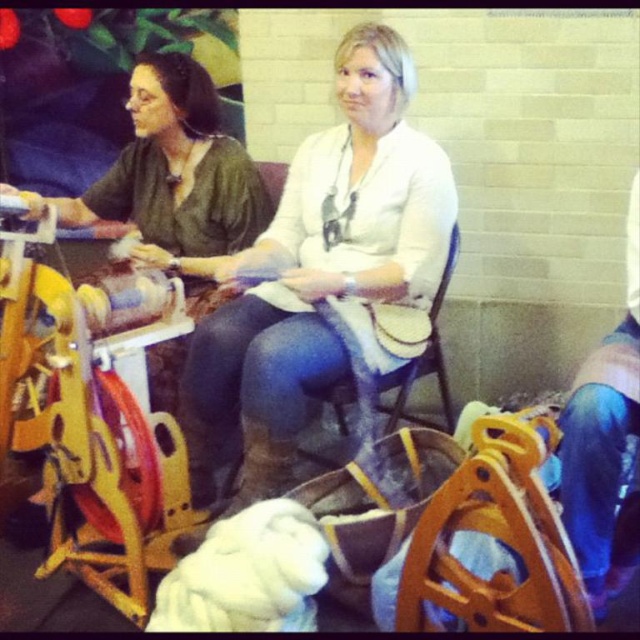
You are a visitor in this workshop and want to hang a small painting on the wall. The green matte fabric at left and the wooden chair at center are in your way. Which object should you move to make space for the painting?

The green matte fabric at left is much taller than the wooden chair at center, so you should move the green matte fabric at left to make space for the painting.

You are a photographer standing in front of the scene. You want to capture a photo where both the white matte sweater at center and the green matte fabric at left are clearly visible. Based on their positions, which object should you focus on first to ensure both are in focus?

The white matte sweater at center is closer to the viewer than the green matte fabric at left. To ensure both are in focus, you should focus on the white matte sweater at center first, as it is closer, and the depth of field may naturally include the farther object.